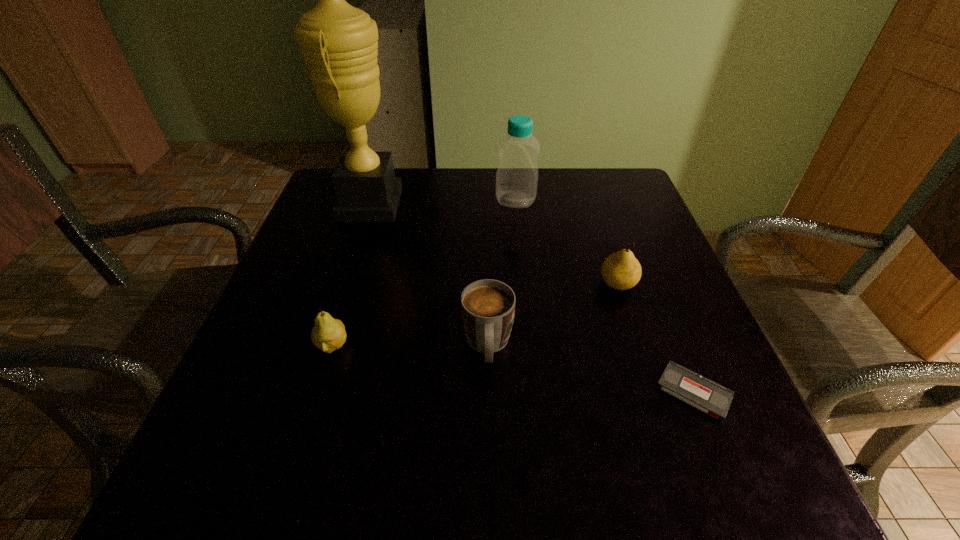
At what (x,y) coordinates should I click in order to perform the action: click on vacant area situated 0.140m on the side of the mug with the handle. Please return your answer as a coordinate pair (x, y). Looking at the image, I should click on (490, 459).

Where is `free location located 0.180m on the front of the left pear`? The image size is (960, 540). free location located 0.180m on the front of the left pear is located at coordinates (297, 464).

Identify the location of free space located 0.360m on the back of the shortest object. The image size is (960, 540). (631, 235).

The width and height of the screenshot is (960, 540). I want to click on trophy cup positioned at the far edge, so click(339, 42).

In order to click on bottle located in the far edge section of the desktop in this screenshot , I will do `click(517, 175)`.

Identify the location of trophy cup that is at the left edge. (339, 42).

At what (x,y) coordinates should I click in order to perform the action: click on pear situated at the left edge. Please return your answer as a coordinate pair (x, y). Looking at the image, I should click on (328, 334).

Where is `pear that is positioned at the right edge`? pear that is positioned at the right edge is located at coordinates (621, 270).

Image resolution: width=960 pixels, height=540 pixels. Find the location of `videotape situated at the right edge`. videotape situated at the right edge is located at coordinates (690, 387).

What are the coordinates of `object positioned at the far left corner` in the screenshot? It's located at click(339, 42).